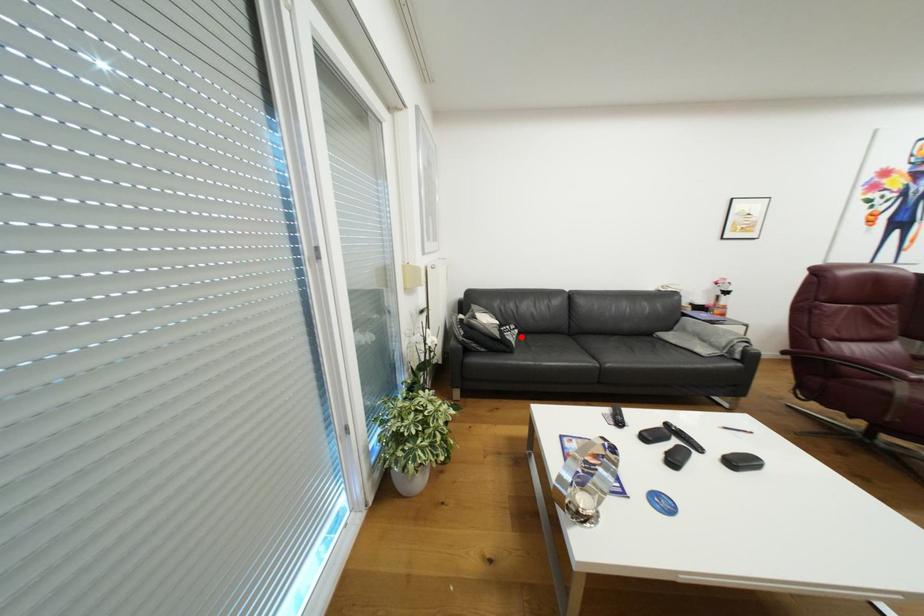
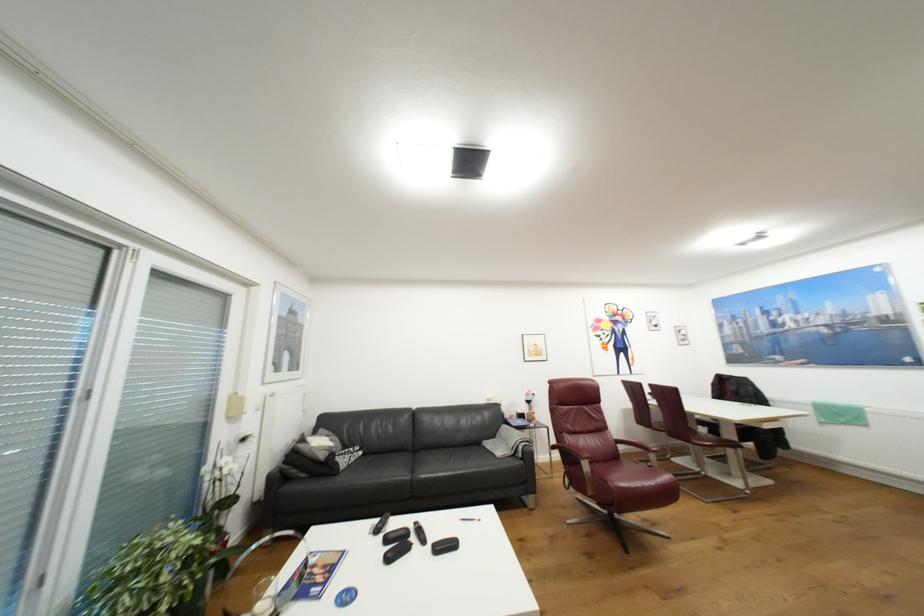
Question: A red point is marked in image1. In image2, is the corresponding 3D point closer to the camera or farther? Reply with the corresponding letter.

Choices:
 (A) The corresponding 3D point is closer.
 (B) The corresponding 3D point is farther.

Answer: (B)